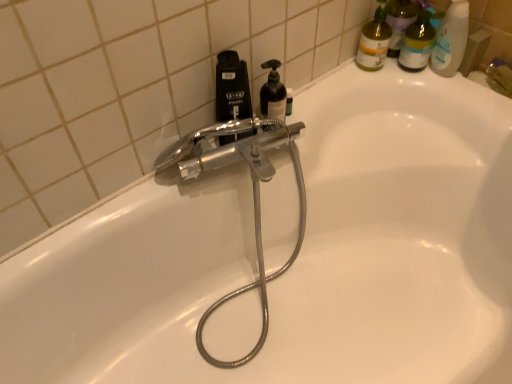
Question: From a real-world perspective, does black matte soap dispenser at upper center stand above translucent plastic bottles at upper right?

Choices:
 (A) no
 (B) yes

Answer: (B)

Question: From the image's perspective, would you say black matte soap dispenser at upper center is positioned over translucent plastic bottles at upper right?

Choices:
 (A) yes
 (B) no

Answer: (B)

Question: Does black matte soap dispenser at upper center turn towards translucent plastic bottles at upper right?

Choices:
 (A) yes
 (B) no

Answer: (B)

Question: Is black matte soap dispenser at upper center positioned behind translucent plastic bottles at upper right?

Choices:
 (A) yes
 (B) no

Answer: (B)

Question: Considering the relative sizes of black matte soap dispenser at upper center and translucent plastic bottles at upper right in the image provided, is black matte soap dispenser at upper center wider than translucent plastic bottles at upper right?

Choices:
 (A) no
 (B) yes

Answer: (B)

Question: Does point (237, 114) appear closer or farther from the camera than point (404, 39)?

Choices:
 (A) farther
 (B) closer

Answer: (B)

Question: Considering the relative positions of black matte soap dispenser at upper center and translucent plastic bottles at upper right in the image provided, is black matte soap dispenser at upper center to the left or to the right of translucent plastic bottles at upper right?

Choices:
 (A) right
 (B) left

Answer: (B)

Question: From the image's perspective, is black matte soap dispenser at upper center positioned above or below translucent plastic bottles at upper right?

Choices:
 (A) above
 (B) below

Answer: (B)

Question: From a real-world perspective, relative to translucent plastic bottles at upper right, is black matte soap dispenser at upper center vertically above or below?

Choices:
 (A) below
 (B) above

Answer: (B)

Question: Is point 262,92 closer or farther from the camera than point 367,34?

Choices:
 (A) closer
 (B) farther

Answer: (A)

Question: Is black matte soap dispenser at upper center inside or outside of matte yellow bottle at upper right?

Choices:
 (A) inside
 (B) outside

Answer: (B)

Question: Relative to matte yellow bottle at upper right, is black matte soap dispenser at upper center in front or behind?

Choices:
 (A) front
 (B) behind

Answer: (A)

Question: From a real-world perspective, is black matte soap dispenser at upper center physically located above or below matte yellow bottle at upper right?

Choices:
 (A) above
 (B) below

Answer: (B)

Question: Visually, is black matte soap dispenser at upper center positioned to the left or to the right of translucent plastic bottles at upper right?

Choices:
 (A) left
 (B) right

Answer: (A)

Question: Based on their sizes in the image, would you say black matte soap dispenser at upper center is bigger or smaller than translucent plastic bottles at upper right?

Choices:
 (A) big
 (B) small

Answer: (B)